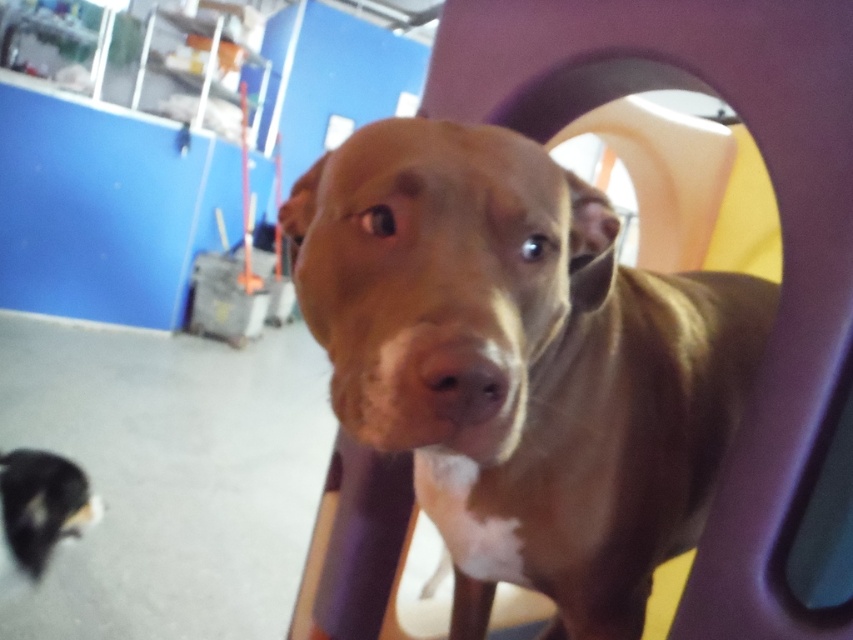
Question: Is brown shiny dog at center positioned behind black fur dog at lower left?

Choices:
 (A) no
 (B) yes

Answer: (A)

Question: Does brown shiny dog at center appear on the left side of black fur dog at lower left?

Choices:
 (A) no
 (B) yes

Answer: (A)

Question: Which object is closer to the camera taking this photo?

Choices:
 (A) brown shiny dog at center
 (B) black fur dog at lower left

Answer: (A)

Question: Does brown shiny dog at center have a smaller size compared to black fur dog at lower left?

Choices:
 (A) yes
 (B) no

Answer: (B)

Question: Which point is closer to the camera taking this photo?

Choices:
 (A) pyautogui.click(x=16, y=461)
 (B) pyautogui.click(x=704, y=387)

Answer: (B)